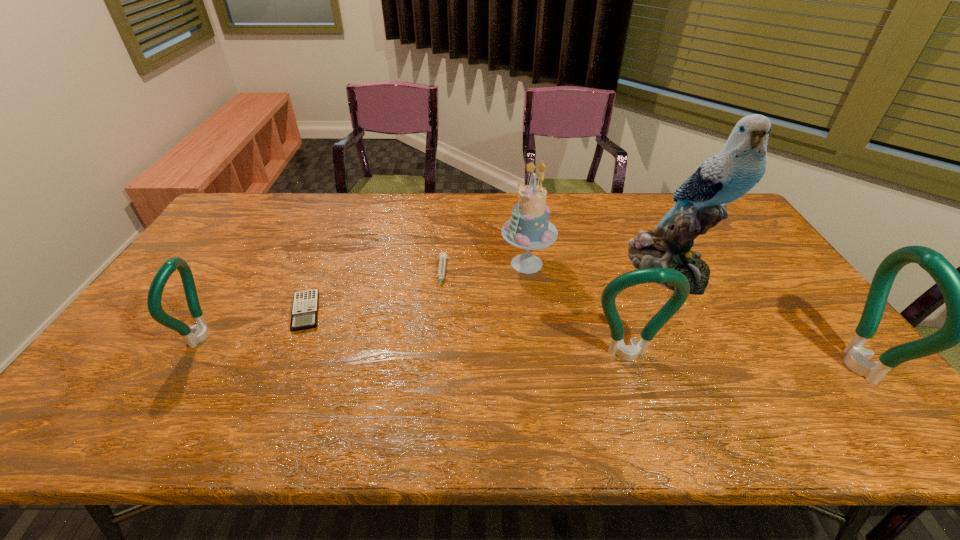
Identify the location of the fifth tallest object. The height and width of the screenshot is (540, 960). (200, 332).

Where is `the leftmost bottle opener`? the leftmost bottle opener is located at coordinates (200, 332).

The height and width of the screenshot is (540, 960). What are the coordinates of `the fifth object from left to right` in the screenshot? It's located at coord(630,352).

Identify the location of the second tallest bottle opener. (630, 352).

This screenshot has width=960, height=540. What are the coordinates of `the rightmost bottle opener` in the screenshot? It's located at (959, 291).

Locate an element on the screen. the sixth tallest object is located at coordinates pos(442,256).

The width and height of the screenshot is (960, 540). I want to click on syringe, so coord(442,256).

Find the location of `the sixth object from right to left`. the sixth object from right to left is located at coordinates (305, 306).

What are the coordinates of `the shortest object` in the screenshot? It's located at (305, 306).

Locate an element on the screen. parakeet is located at coordinates pyautogui.click(x=739, y=166).